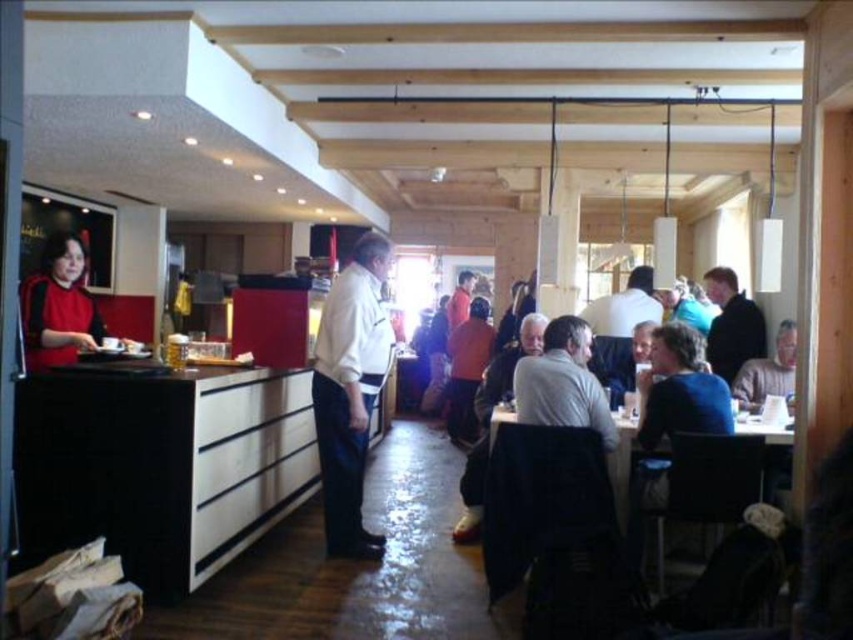
Question: In this image, where is matte red sweater at left located relative to wooden table at center?

Choices:
 (A) above
 (B) below

Answer: (A)

Question: Which object is positioned closest to the gray wool sweater at center?

Choices:
 (A) matte red sweater at left
 (B) white smooth shirt at center

Answer: (B)

Question: Estimate the real-world distances between objects in this image. Which object is farther from the wooden table at center?

Choices:
 (A) matte red sweater at left
 (B) dark brown leather jacket at upper right

Answer: (A)

Question: Can you confirm if white smooth shirt at center is thinner than wooden table at center?

Choices:
 (A) no
 (B) yes

Answer: (A)

Question: Does matte red sweater at left lie behind light brown sweater at center?

Choices:
 (A) yes
 (B) no

Answer: (B)

Question: Which point is farther from the camera taking this photo?

Choices:
 (A) (776, 358)
 (B) (740, 433)
 (C) (758, 323)

Answer: (C)